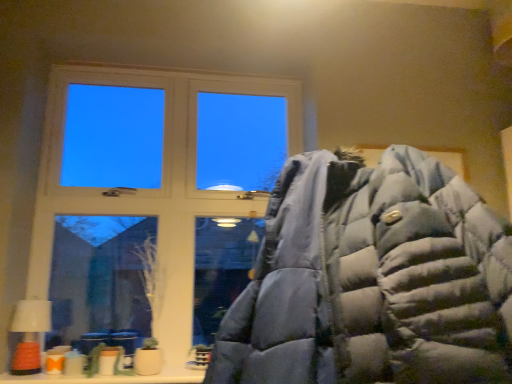
Question: Can you confirm if orange matte lampshade at lower left is thinner than white wood window at upper left?

Choices:
 (A) yes
 (B) no

Answer: (B)

Question: Is orange matte lampshade at lower left facing away from white wood window at upper left?

Choices:
 (A) no
 (B) yes

Answer: (B)

Question: Is orange matte lampshade at lower left next to white wood window at upper left?

Choices:
 (A) no
 (B) yes

Answer: (A)

Question: From the image's perspective, would you say orange matte lampshade at lower left is positioned over white wood window at upper left?

Choices:
 (A) yes
 (B) no

Answer: (B)

Question: Is orange matte lampshade at lower left to the left of white wood window at upper left from the viewer's perspective?

Choices:
 (A) no
 (B) yes

Answer: (B)

Question: Can you confirm if orange matte lampshade at lower left is positioned to the right of white wood window at upper left?

Choices:
 (A) no
 (B) yes

Answer: (A)

Question: Is the depth of matte blue puffer jacket at center less than that of white wood window at upper left?

Choices:
 (A) yes
 (B) no

Answer: (A)

Question: From the image's perspective, is matte blue puffer jacket at center under white wood window at upper left?

Choices:
 (A) yes
 (B) no

Answer: (A)

Question: From a real-world perspective, is matte blue puffer jacket at center physically above white wood window at upper left?

Choices:
 (A) no
 (B) yes

Answer: (A)

Question: Is matte blue puffer jacket at center in contact with white wood window at upper left?

Choices:
 (A) yes
 (B) no

Answer: (B)

Question: Can you confirm if matte blue puffer jacket at center is taller than white wood window at upper left?

Choices:
 (A) yes
 (B) no

Answer: (B)

Question: Is matte blue puffer jacket at center outside of white wood window at upper left?

Choices:
 (A) no
 (B) yes

Answer: (B)

Question: Would you consider orange matte lampshade at lower left to be distant from matte blue puffer jacket at center?

Choices:
 (A) yes
 (B) no

Answer: (A)